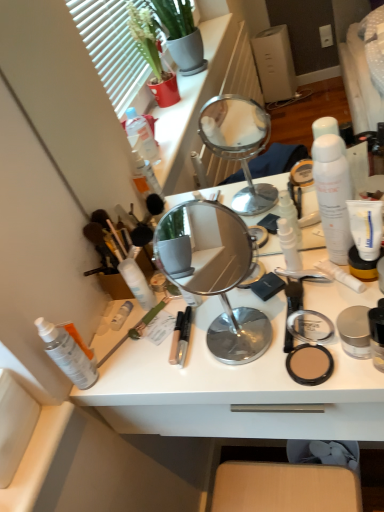
Image resolution: width=384 pixels, height=512 pixels. I want to click on vacant area that lies to the right of green matte brush at center, so click(x=207, y=320).